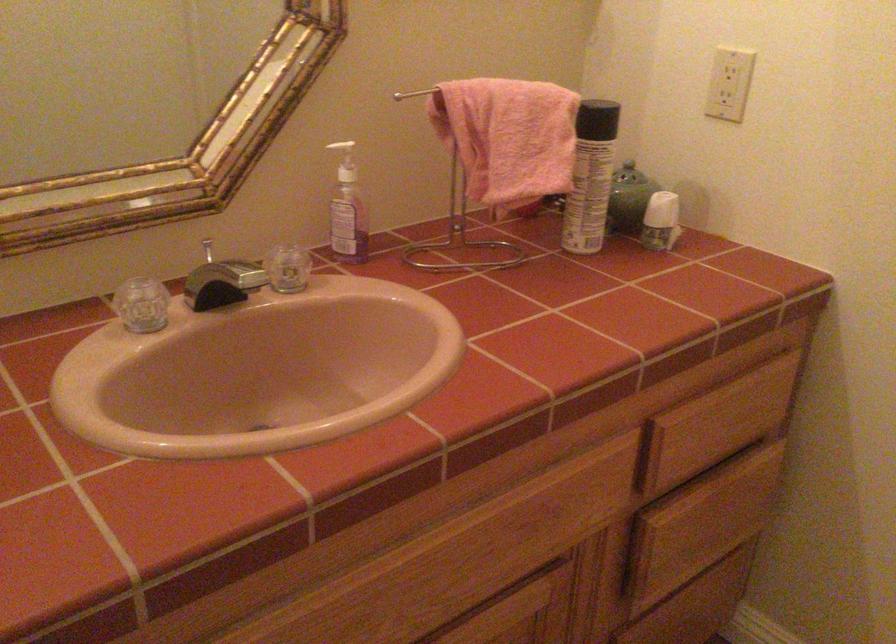
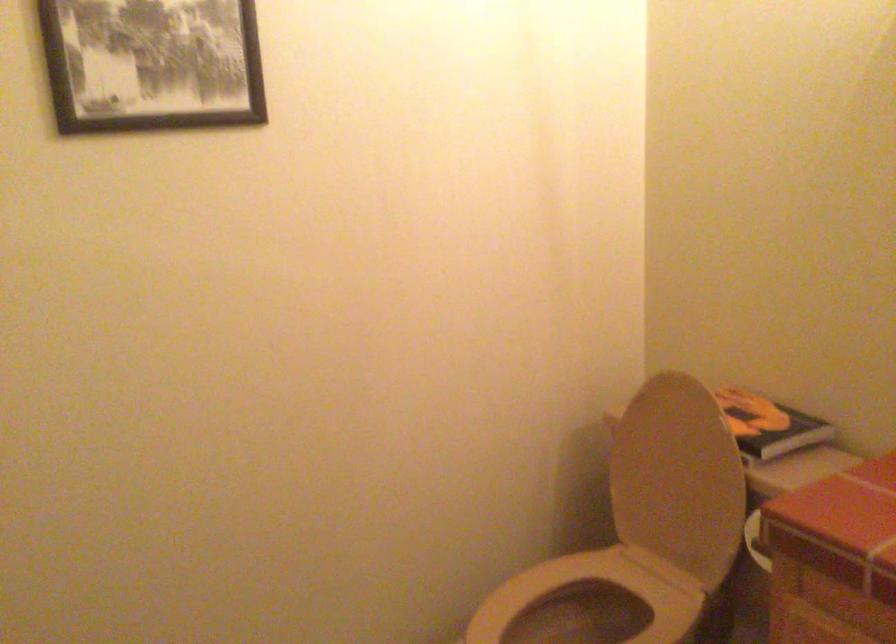
The images are taken continuously from a first-person perspective. In which direction is your viewpoint rotating?

The camera's rotation is toward left-down.